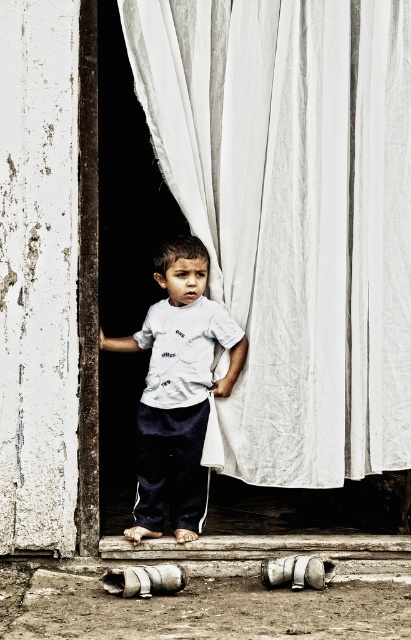
You are a photographer standing in a hallway. You see a white fabric curtain at center. If you want to take a photo of the curtain so that it fills the frame, should you move closer or farther away?

Since the white fabric curtain at center is 5.81 meters away from the camera, you should move closer to the curtain to fill the frame.

You need to hang a white cotton shirt on a coat hanger. The coat hanger can only hold items up to the width of the white fabric curtain at center. Will the white cotton shirt at center fit on the hanger?

The white fabric curtain at center is wider than the white cotton shirt at center, so the shirt will fit on the hanger since its width is smaller than the curtain.